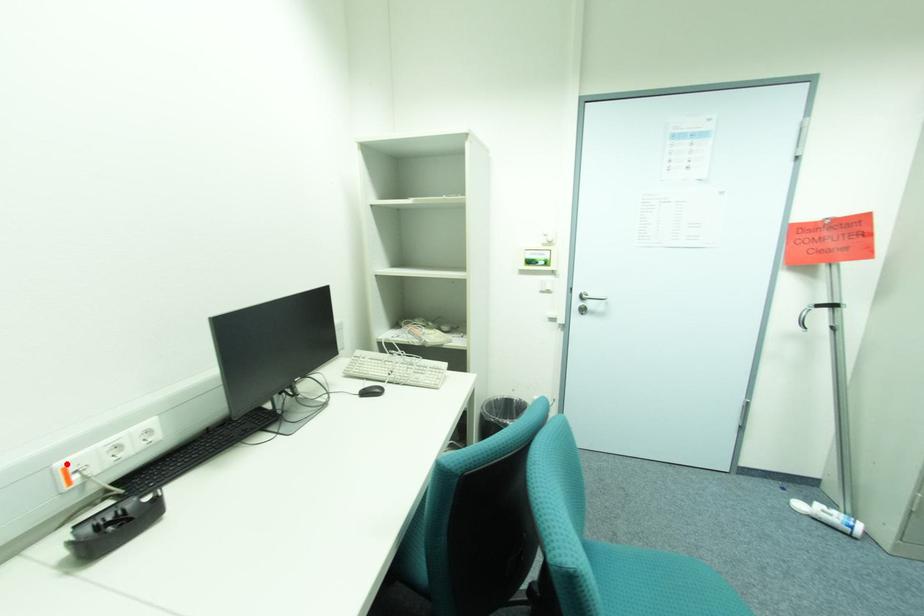
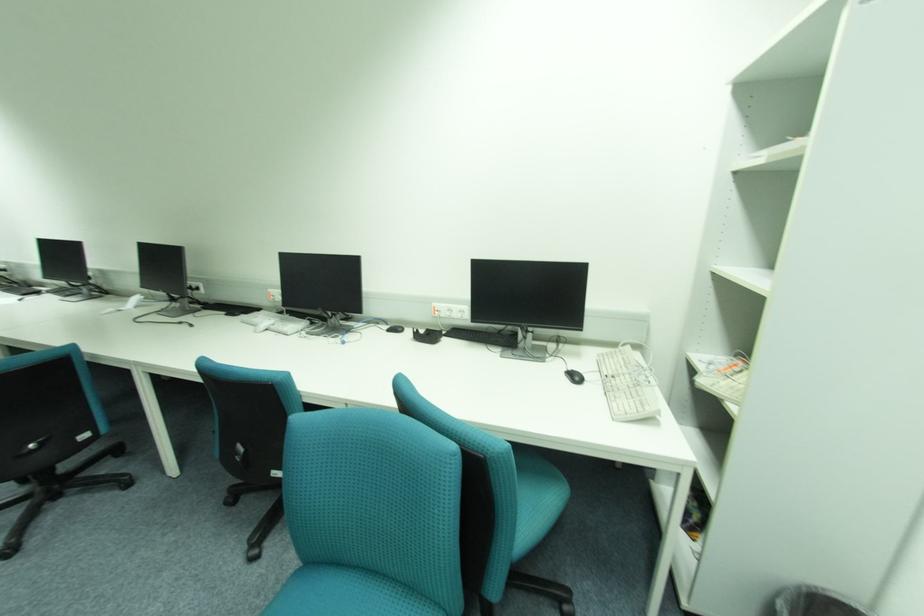
Find the pixel in the second image that matches the highlighted location in the first image.

(441, 305)